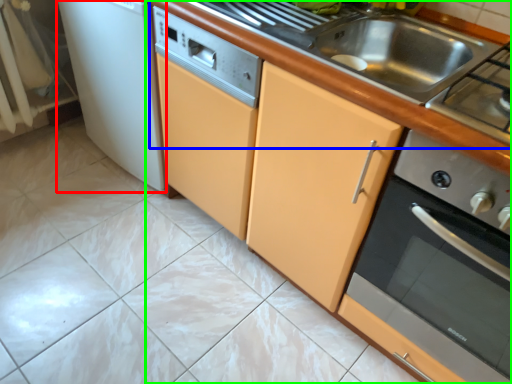
Question: Which object is the closest to the home appliance (highlighted by a red box)? Choose among these: counter top (highlighted by a blue box) or countertop (highlighted by a green box).

Choices:
 (A) counter top
 (B) countertop

Answer: (B)